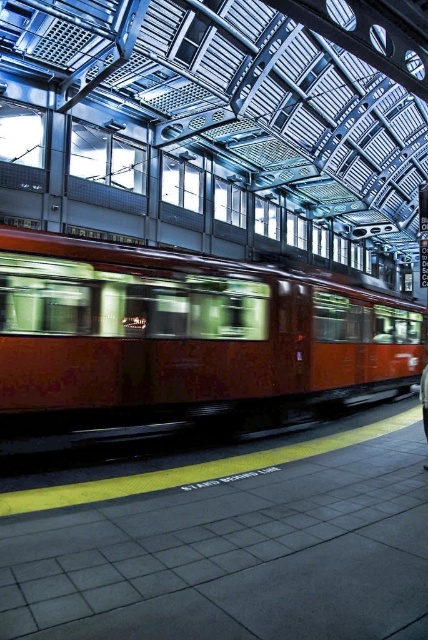
Question: Is matte orange train at center smaller than dark blue jeans at center?

Choices:
 (A) yes
 (B) no

Answer: (B)

Question: Does matte orange train at center come in front of dark blue jeans at center?

Choices:
 (A) no
 (B) yes

Answer: (B)

Question: Among these points, which one is nearest to the camera?

Choices:
 (A) (427, 394)
 (B) (53, 237)

Answer: (A)

Question: Among these points, which one is farthest from the camera?

Choices:
 (A) (425, 397)
 (B) (174, 289)

Answer: (B)

Question: Which point is closer to the camera taking this photo?

Choices:
 (A) pyautogui.click(x=425, y=390)
 (B) pyautogui.click(x=41, y=429)

Answer: (A)

Question: Can you confirm if matte orange train at center is positioned to the right of dark blue jeans at center?

Choices:
 (A) no
 (B) yes

Answer: (A)